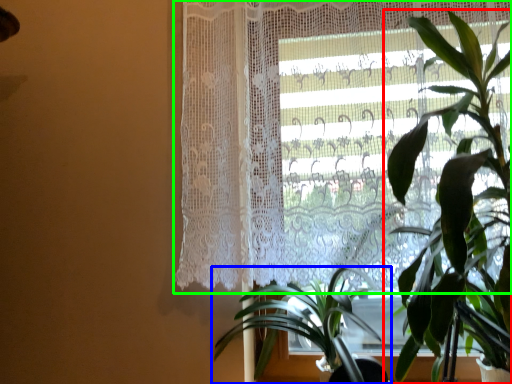
Question: Based on their relative distances, which object is farther from houseplant (highlighted by a red box)? Choose from houseplant (highlighted by a blue box) and curtain (highlighted by a green box).

Choices:
 (A) houseplant
 (B) curtain

Answer: (A)